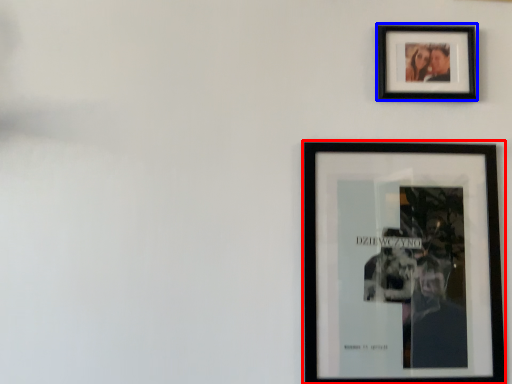
Question: Which object appears farthest to the camera in this image, picture frame (highlighted by a red box) or picture frame (highlighted by a blue box)?

Choices:
 (A) picture frame
 (B) picture frame

Answer: (B)